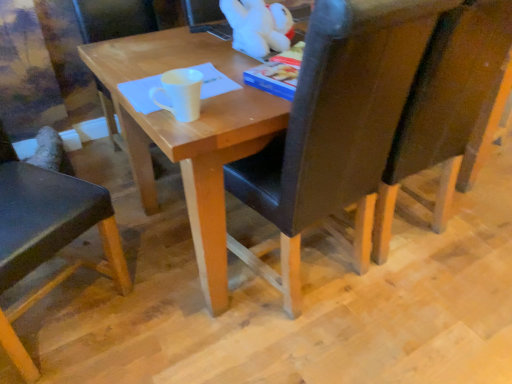
Find the location of a particular element. Image resolution: width=512 pixels, height=384 pixels. vacant area that is situated to the right of matte black chair at left, the 4th chair from the right is located at coordinates (146, 324).